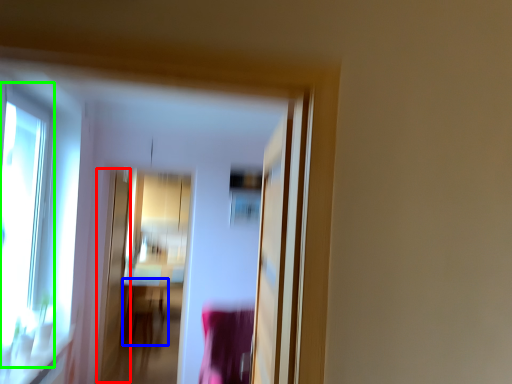
Question: Which object is positioned farthest from screen door (highlighted by a red box)? Select from table (highlighted by a blue box) and window (highlighted by a green box).

Choices:
 (A) table
 (B) window

Answer: (A)